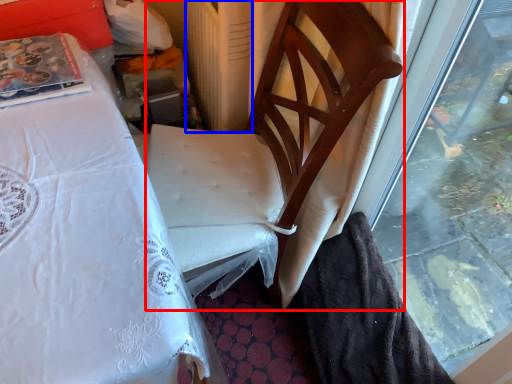
Question: Among these objects, which one is farthest to the camera, chair (highlighted by a red box) or radiator (highlighted by a blue box)?

Choices:
 (A) chair
 (B) radiator

Answer: (B)